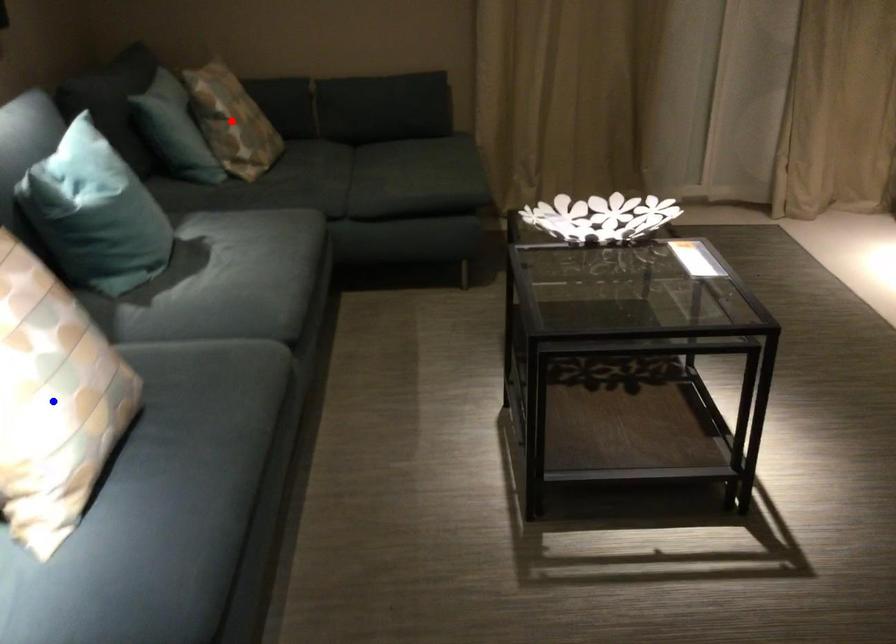
Question: Which of the two points in the image is closer to the camera?

Choices:
 (A) Blue point is closer.
 (B) Red point is closer.

Answer: (A)